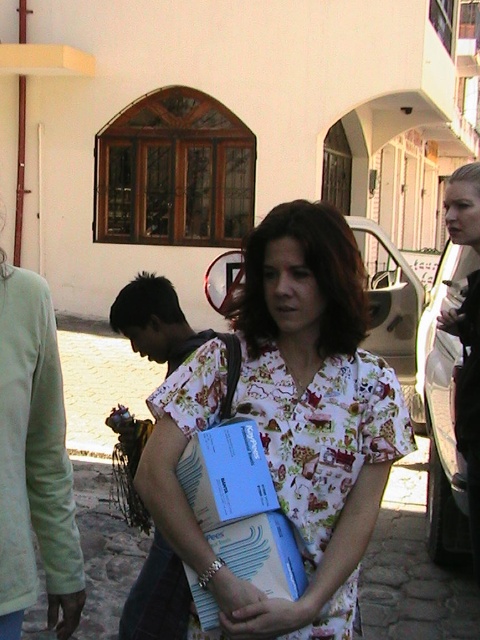
Is floral fabric dress at center thinner than floral fabric shirt at center?

No, floral fabric dress at center is not thinner than floral fabric shirt at center.

Who is positioned more to the left, floral fabric dress at center or floral fabric shirt at center?

Positioned to the left is floral fabric shirt at center.

Consider the image. Who is more distant from viewer, (319,572) or (149,340)?

The point (149,340) is more distant.

Find the location of `floral fabric dress at center`. floral fabric dress at center is located at coordinates (290, 422).